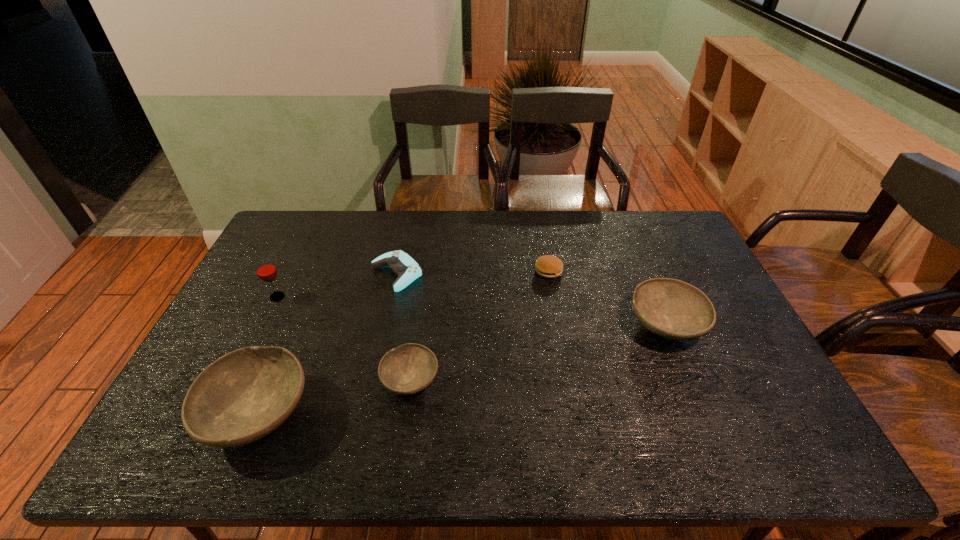
Identify the location of vacant area that satisfies the following two spatial constraints: 1. on the front side of the second bowl from right to left; 2. on the left side of the glass. The image size is (960, 540). (237, 380).